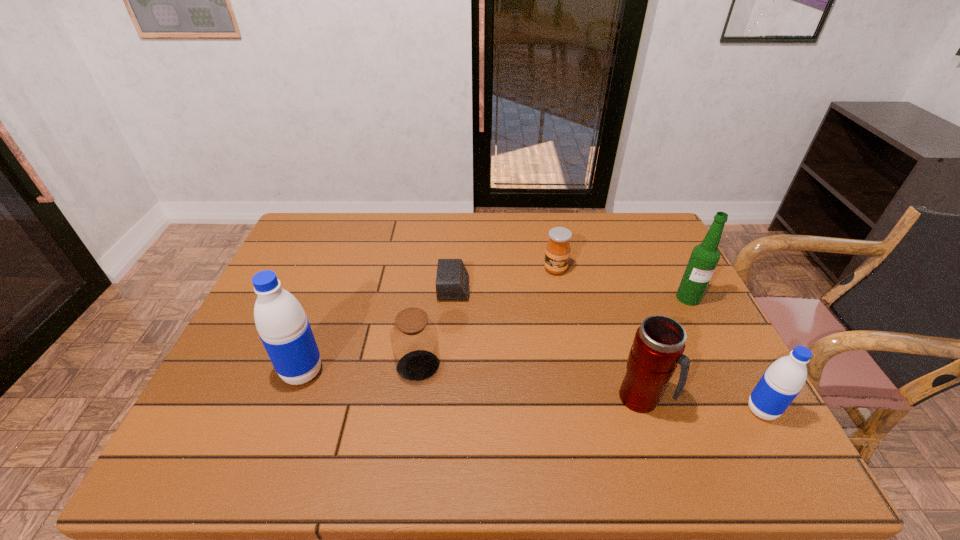
This screenshot has width=960, height=540. I want to click on empty location between the shortest object and the thermos bottle, so click(547, 344).

Where is `vacant space that is in between the fourth object from right to left and the shortest object`? This screenshot has height=540, width=960. vacant space that is in between the fourth object from right to left and the shortest object is located at coordinates (505, 279).

Find the location of a particular element. The width and height of the screenshot is (960, 540). unoccupied position between the fifth tallest object and the taller water bottle is located at coordinates (360, 369).

The height and width of the screenshot is (540, 960). Identify the location of free space between the thermos bottle and the fifth tallest object. (530, 383).

This screenshot has width=960, height=540. I want to click on free space between the third shortest object and the left water bottle, so click(360, 369).

What are the coordinates of `free space between the nearer water bottle and the left water bottle` in the screenshot? It's located at (532, 391).

Where is `unoccupied position between the thermos bottle and the nearer water bottle`? The height and width of the screenshot is (540, 960). unoccupied position between the thermos bottle and the nearer water bottle is located at coordinates (702, 404).

The width and height of the screenshot is (960, 540). What are the coordinates of `empty space that is in between the fourth object from right to left and the third object from right to left` in the screenshot? It's located at (598, 334).

Find the location of a particular element. The image size is (960, 540). free area in between the fifth tallest object and the third object from right to left is located at coordinates (530, 383).

Where is `object that ranks as the second closest to the shortest object`? This screenshot has width=960, height=540. object that ranks as the second closest to the shortest object is located at coordinates (557, 253).